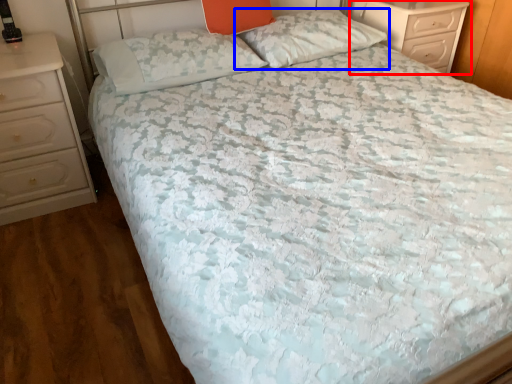
Question: Which object is further to the camera taking this photo, chest of drawers (highlighted by a red box) or pillow (highlighted by a blue box)?

Choices:
 (A) chest of drawers
 (B) pillow

Answer: (A)